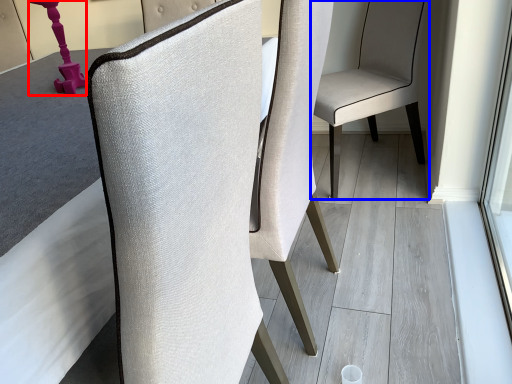
Question: Among these objects, which one is nearest to the camera, table lamp (highlighted by a red box) or chair (highlighted by a blue box)?

Choices:
 (A) table lamp
 (B) chair

Answer: (A)